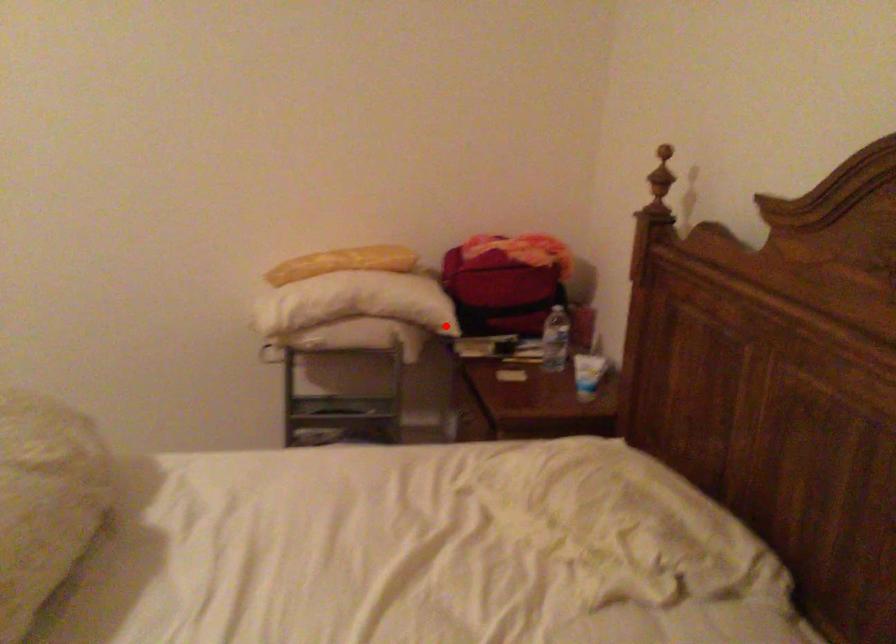
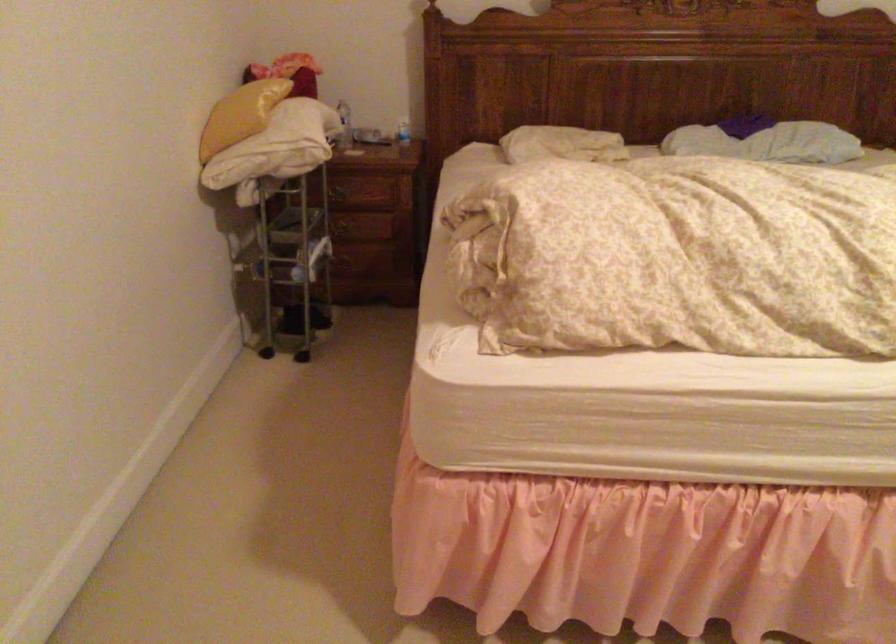
Question: I am providing you with two images of the same scene from different viewpoints. Given a red point in image1, look at the same physical point in image2. Is it:

Choices:
 (A) Closer to the viewpoint
 (B) Farther from the viewpoint

Answer: (B)